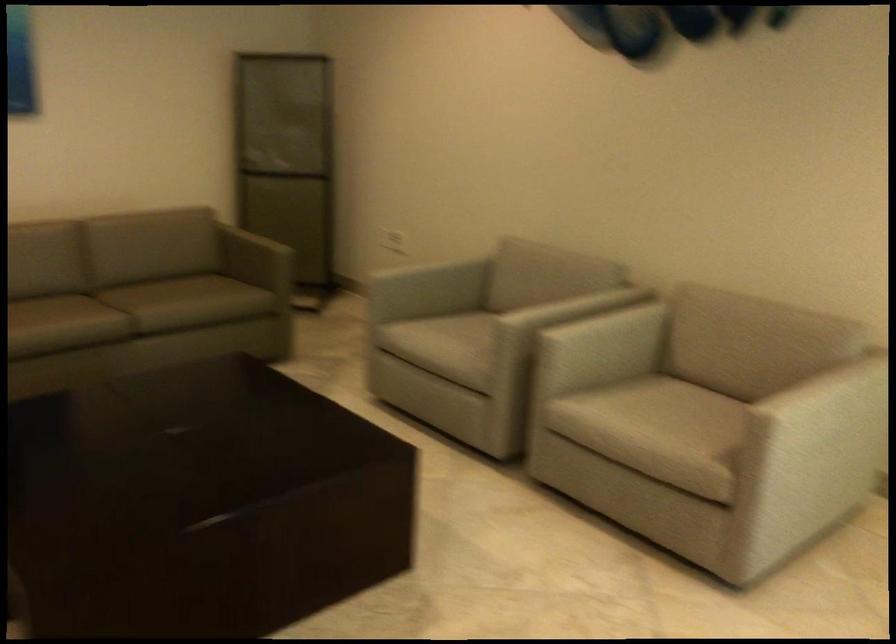
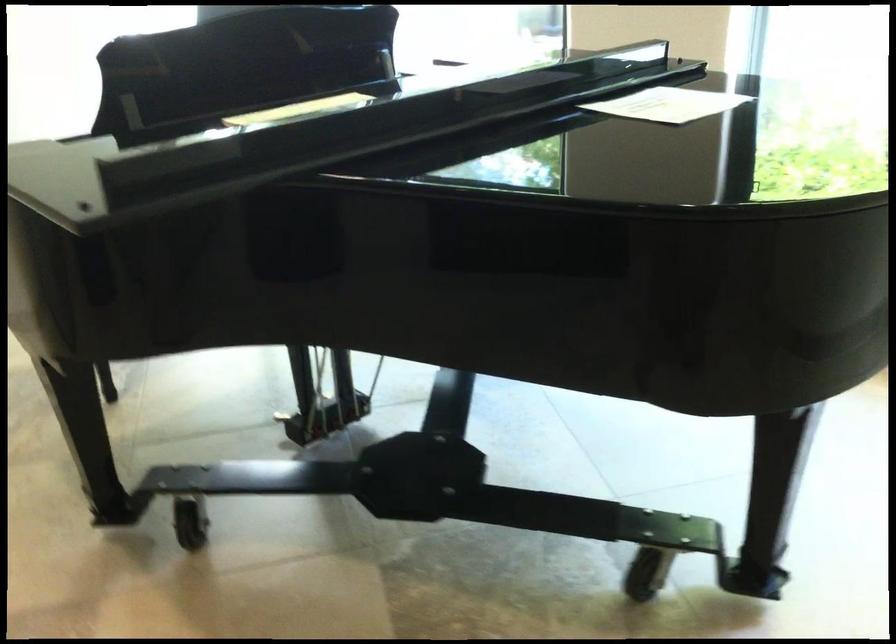
First-person continuous shooting, in which direction is the camera rotating?

The rotation direction of the camera is right-down.